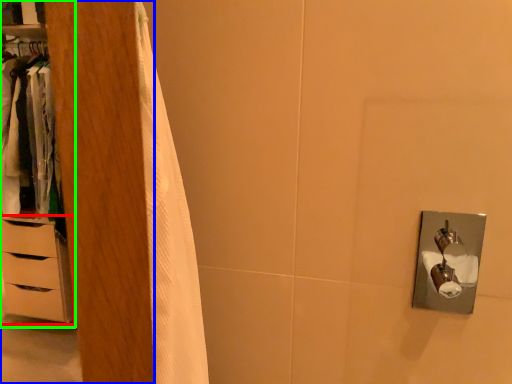
Question: Estimate the real-world distances between objects in this image. Which object is closer to chest of drawers (highlighted by a red box), armoire (highlighted by a blue box) or dresser (highlighted by a green box)?

Choices:
 (A) armoire
 (B) dresser

Answer: (B)